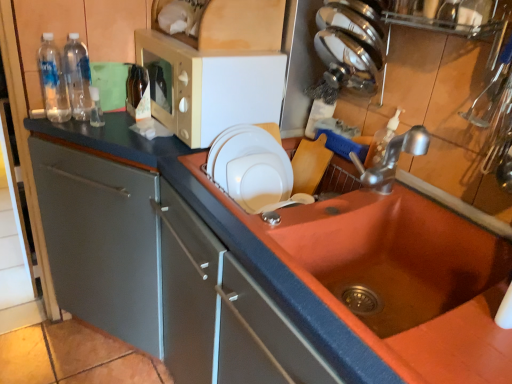
Identify the location of vacant space to the right of clear plastic bottle at left, which is the second bottle from left to right. (118, 123).